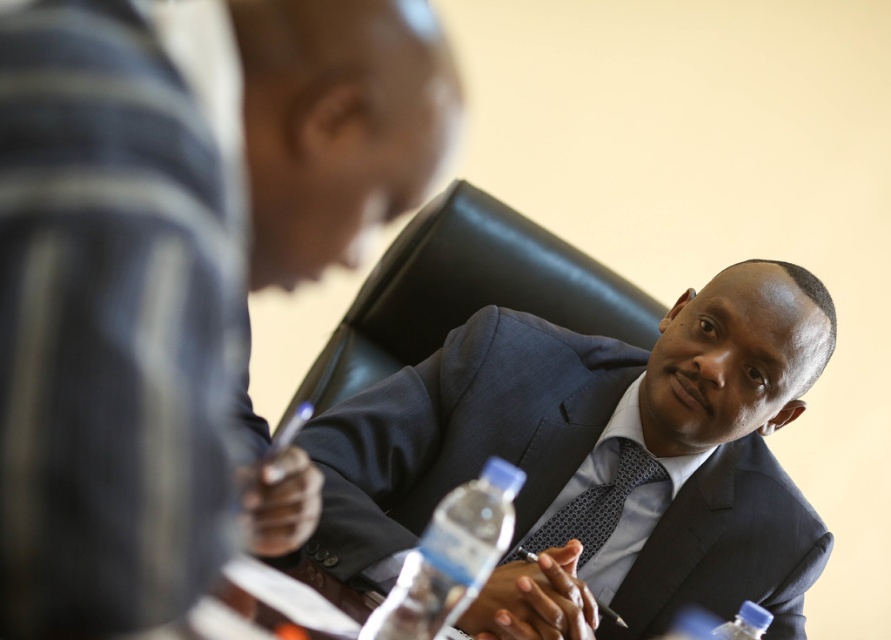
You are a photographer trying to capture a candid shot of the dark blue textured suit at center and the clear plastic bottle at lower center. Since the camera can only focus on one subject at a time, which object should you prioritize to ensure the other remains in the background but still visible?

The dark blue textured suit at center is much taller than the clear plastic bottle at lower center, so focusing on the dark blue textured suit at center would keep the clear plastic bottle at lower center in the background while still visible.

You are organizing a meeting and need to place a name tag for the seated person. The name tag is 2 inches wide. Can you fit it between the clear plastic bottle at lower center and the dark blue textured tie at center without overlapping either?

The distance between the clear plastic bottle at lower center and the dark blue textured tie at center is 11.39 inches. Since the name tag is only 2 inches wide, there is sufficient space to place it between them without overlapping either object.

You are standing in a meeting room and want to place a 1.2 meter long table between you and the point at coordinates point (467, 429). Can you fit the table between you and that point?

The distance between you and point (467, 429) is 1.19 meters, which is shorter than the table length of 1.2 meters. Therefore, the table cannot be placed between you and the point.